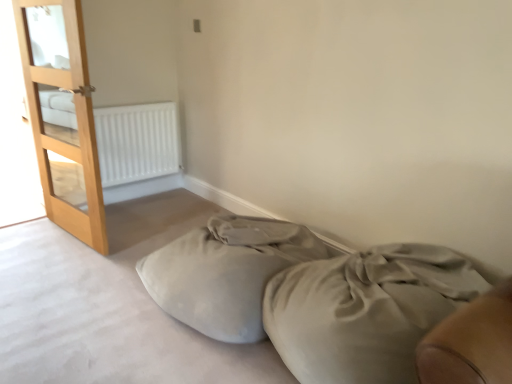
Question: Does white matte radiator at upper left have a greater width compared to light brown wooden door at left?

Choices:
 (A) no
 (B) yes

Answer: (B)

Question: From a real-world perspective, is white matte radiator at upper left positioned under light brown wooden door at left based on gravity?

Choices:
 (A) yes
 (B) no

Answer: (A)

Question: Is white matte radiator at upper left positioned with its back to light brown wooden door at left?

Choices:
 (A) yes
 (B) no

Answer: (B)

Question: Is white matte radiator at upper left behind light brown wooden door at left?

Choices:
 (A) yes
 (B) no

Answer: (A)

Question: Can you confirm if white matte radiator at upper left is bigger than light brown wooden door at left?

Choices:
 (A) no
 (B) yes

Answer: (A)

Question: Is satin beige bed at lower right inside or outside of white matte radiator at upper left?

Choices:
 (A) outside
 (B) inside

Answer: (A)

Question: Considering the relative positions of satin beige bed at lower right and white matte radiator at upper left in the image provided, is satin beige bed at lower right to the left or to the right of white matte radiator at upper left?

Choices:
 (A) left
 (B) right

Answer: (B)

Question: Is point (445, 283) positioned closer to the camera than point (134, 114)?

Choices:
 (A) closer
 (B) farther

Answer: (A)

Question: Is satin beige bed at lower right taller or shorter than white matte radiator at upper left?

Choices:
 (A) tall
 (B) short

Answer: (B)

Question: Is soft beige fabric bean bag at lower center situated inside white matte radiator at upper left or outside?

Choices:
 (A) outside
 (B) inside

Answer: (A)

Question: In terms of height, does soft beige fabric bean bag at lower center look taller or shorter compared to white matte radiator at upper left?

Choices:
 (A) tall
 (B) short

Answer: (B)

Question: Is point (211, 279) closer or farther from the camera than point (122, 168)?

Choices:
 (A) farther
 (B) closer

Answer: (B)

Question: Considering the positions of soft beige fabric bean bag at lower center and white matte radiator at upper left in the image, is soft beige fabric bean bag at lower center bigger or smaller than white matte radiator at upper left?

Choices:
 (A) small
 (B) big

Answer: (B)

Question: Would you say satin beige bed at lower right is inside or outside soft beige fabric bean bag at lower center?

Choices:
 (A) inside
 (B) outside

Answer: (B)

Question: Does point (337, 349) appear closer or farther from the camera than point (190, 271)?

Choices:
 (A) farther
 (B) closer

Answer: (B)